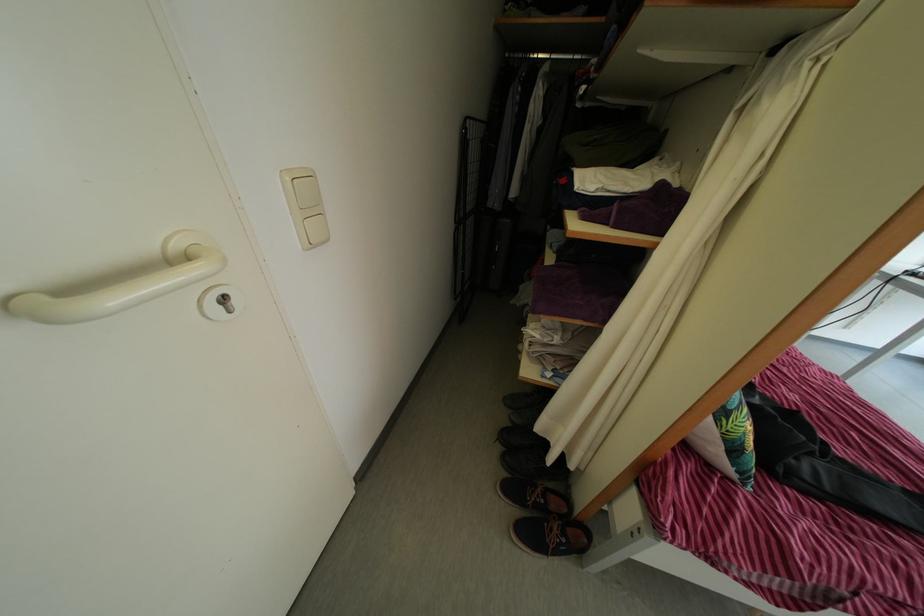
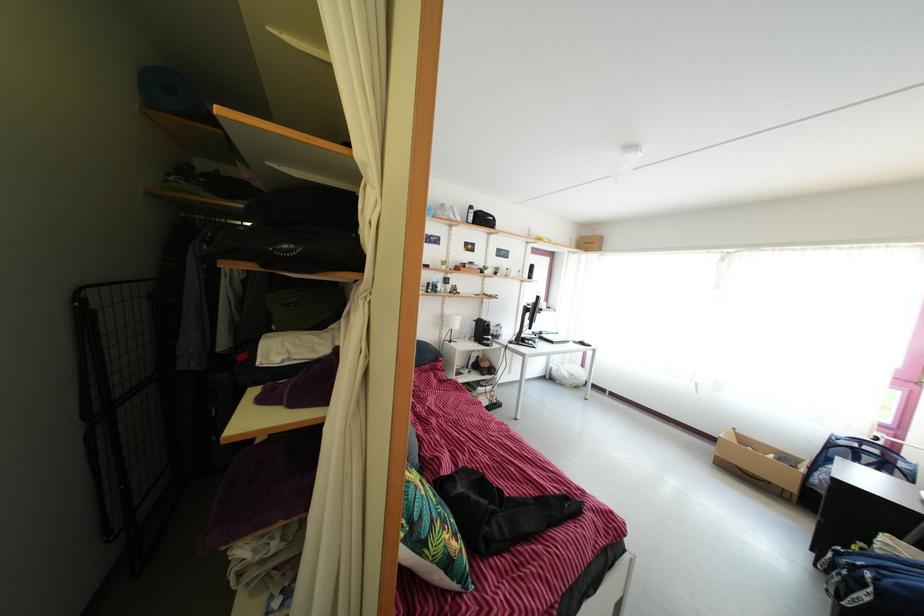
Locate, in the second image, the point that corresponds to (470,136) in the first image.

(86, 307)